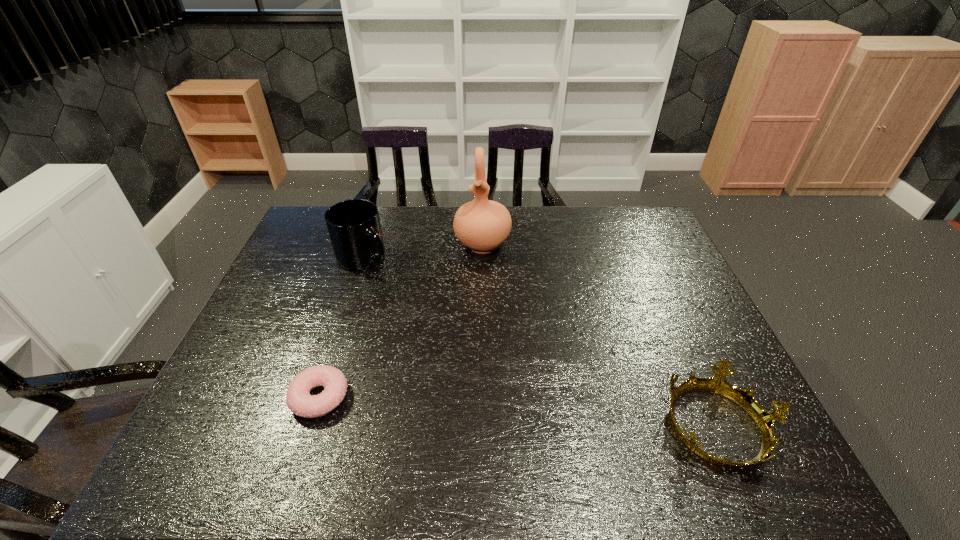
Locate an element on the screen. free region located with the handle on the side of the second tallest object is located at coordinates (439, 355).

Where is `vacant point located on the spout of the pottery`? This screenshot has height=540, width=960. vacant point located on the spout of the pottery is located at coordinates (475, 354).

Where is `vacant position located 0.240m on the spout of the pottery`? Image resolution: width=960 pixels, height=540 pixels. vacant position located 0.240m on the spout of the pottery is located at coordinates (478, 315).

At what (x,y) coordinates should I click in order to perform the action: click on free space located on the spout of the pottery. Please return your answer as a coordinate pair (x, y). Looking at the image, I should click on (475, 354).

At what (x,y) coordinates should I click in order to perform the action: click on mug at the far edge. Please return your answer as a coordinate pair (x, y). Looking at the image, I should click on (354, 227).

Find the location of `pottery situated at the far edge`. pottery situated at the far edge is located at coordinates (482, 225).

This screenshot has height=540, width=960. Identify the location of doughnut that is positioned at the near edge. (299, 401).

Image resolution: width=960 pixels, height=540 pixels. I want to click on crown that is at the near edge, so click(765, 420).

This screenshot has width=960, height=540. I want to click on object present at the right edge, so click(x=765, y=420).

This screenshot has width=960, height=540. Find the location of `object at the near right corner`. object at the near right corner is located at coordinates (765, 420).